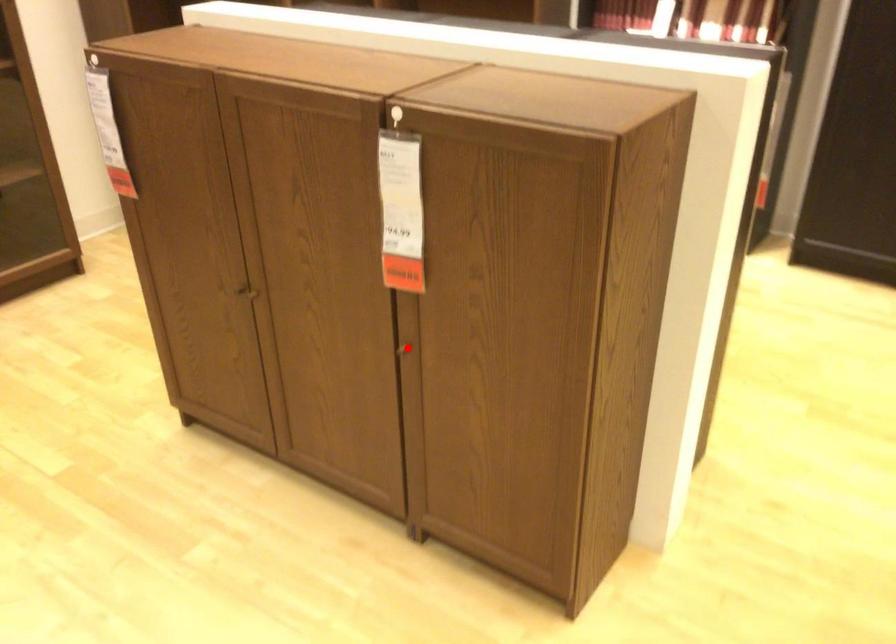
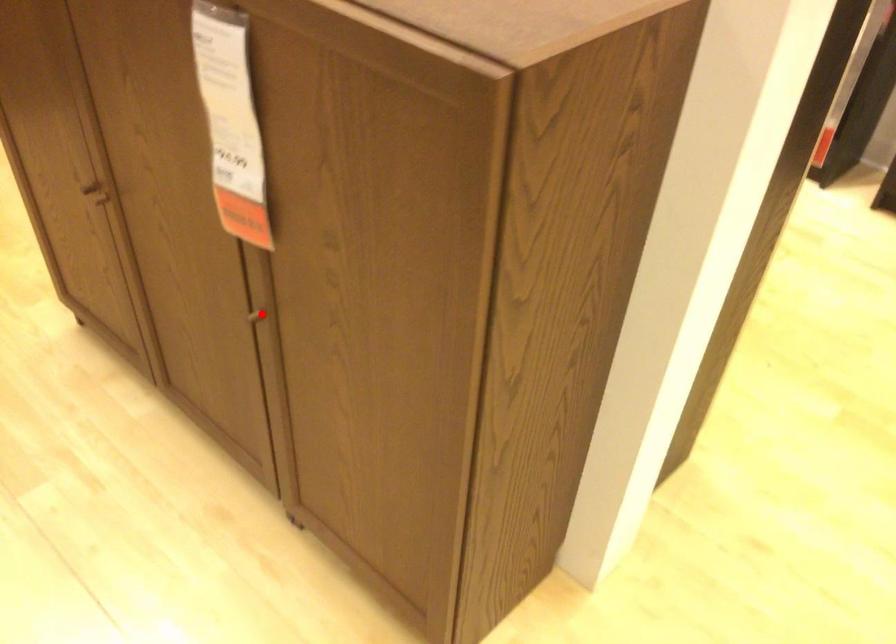
I am providing you with two images of the same scene from different viewpoints. A red point is marked on the first image and another point is marked on the second image. Do the highlighted points in image1 and image2 indicate the same real-world spot?

Yes